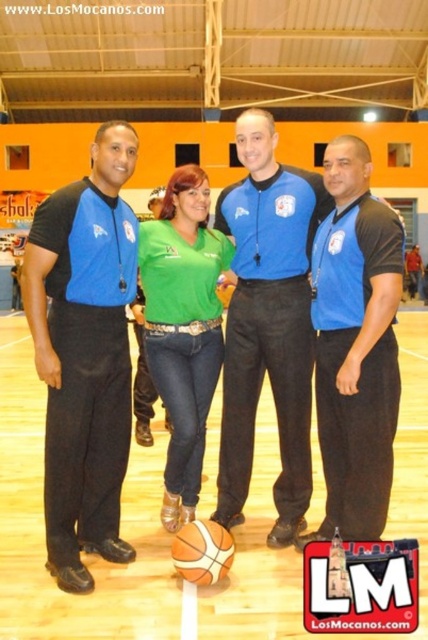
Question: Which of the following is the closest to the observer?

Choices:
 (A) matte blue shirts at center
 (B) blue fabric shirt at center

Answer: (B)

Question: Which object is closer to the camera taking this photo?

Choices:
 (A) matte blue shirts at center
 (B) green matte shirt at center
 (C) orange textured basketball at center
 (D) blue fabric shirt at center

Answer: (D)

Question: Can you confirm if matte blue shirts at center is positioned above blue fabric shirt at center?

Choices:
 (A) yes
 (B) no

Answer: (A)

Question: Does green matte shirt at center have a larger size compared to orange textured basketball at center?

Choices:
 (A) no
 (B) yes

Answer: (B)

Question: Estimate the real-world distances between objects in this image. Which object is closer to the green matte shirt at center?

Choices:
 (A) matte blue shirts at center
 (B) blue fabric shirt at center
 (C) matte blue shirt at left

Answer: (A)

Question: Is matte blue shirt at left below blue fabric shirt at center?

Choices:
 (A) yes
 (B) no

Answer: (B)